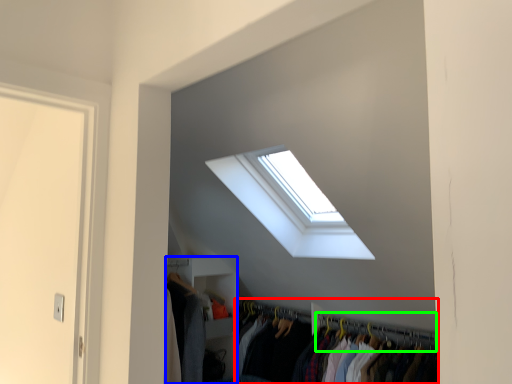
Question: Considering the real-world distances, which object is closest to closet (highlighted by a red box)? closet (highlighted by a blue box) or hanger (highlighted by a green box).

Choices:
 (A) closet
 (B) hanger

Answer: (B)